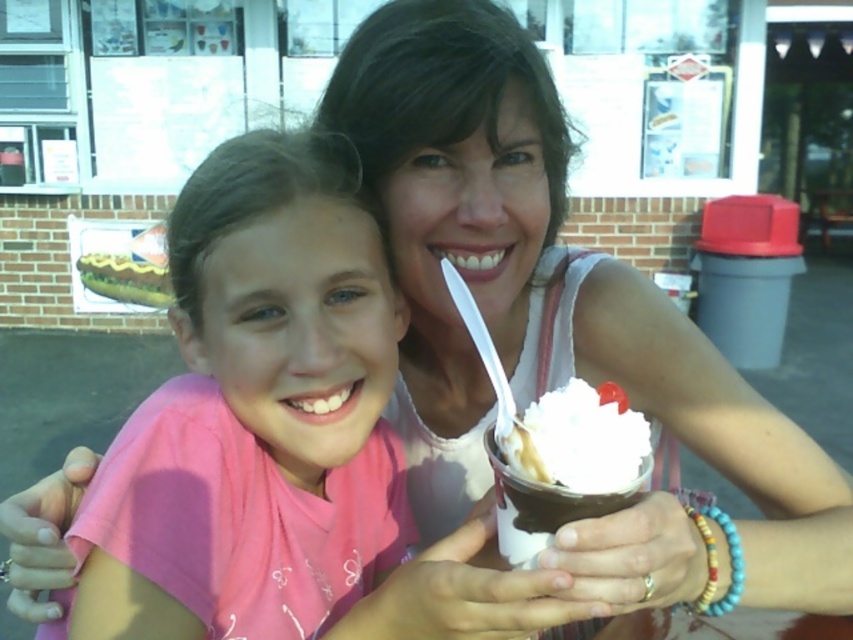
You are a photographer standing 10 feet away from the scene. You want to capture a closeup shot of both the pink fabric shirt at center and the white creamy ice cream at center in the same frame. Given that your camera has a maximum focus range of 8 inches, will you be able to achieve this?

The pink fabric shirt at center and the white creamy ice cream at center are 7.64 inches apart, which is within the camera maximum focus range of 8 inches. Therefore, you can capture both in the same frame.

You are a photographer trying to capture a closeup of the white creamy ice cream at center without including the pink fabric shirt at center in the frame. Based on their positions, is this possible?

The pink fabric shirt at center is positioned on the left side of white creamy ice cream at center, so if you position your camera to the right side of the ice cream, you can capture the white creamy ice cream at center without including the pink fabric shirt at center in the frame.

You are standing at the point marked as point [287,300] in the image. What object is located at this point?

The point [287,300] corresponds to the pink fabric shirt at center.